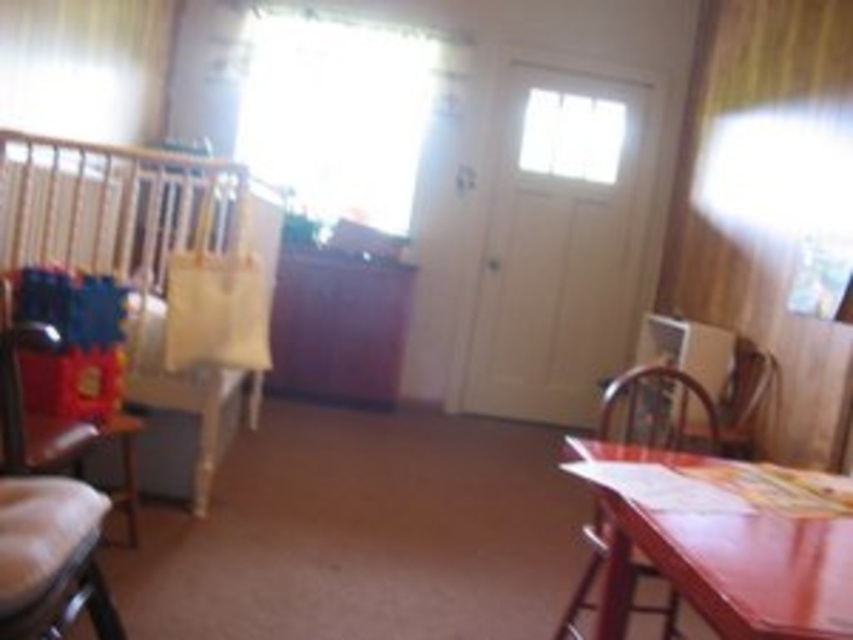
Can you confirm if wooden paneling at upper right is positioned to the left of wooden chair at right?

No, wooden paneling at upper right is not to the left of wooden chair at right.

Can you confirm if wooden paneling at upper right is positioned above wooden chair at right?

Yes.

Describe the element at coordinates (762, 200) in the screenshot. I see `wooden paneling at upper right` at that location.

The height and width of the screenshot is (640, 853). What are the coordinates of `wooden paneling at upper right` in the screenshot? It's located at (762, 200).

Is wooden chair at right smaller than brown leather armchair at right?

No.

Looking at this image, can you confirm if wooden chair at right is positioned to the left of brown leather armchair at right?

Yes, wooden chair at right is to the left of brown leather armchair at right.

What are the coordinates of `wooden chair at right` in the screenshot? It's located at (657, 412).

Measure the distance between wooden table at lower right and wooden chair at right.

They are 22.52 inches apart.

Who is positioned more to the right, wooden table at lower right or wooden chair at right?

Positioned to the right is wooden chair at right.

Does point (618, 557) lie in front of point (706, 408)?

Yes, point (618, 557) is closer to viewer.

Where is `wooden table at lower right`? The image size is (853, 640). wooden table at lower right is located at coordinates (733, 572).